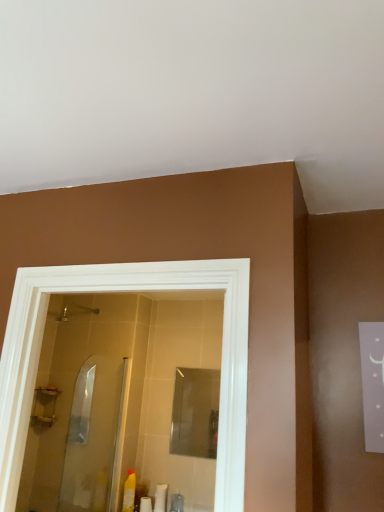
Question: Is white matte tube at lower center, the second toiletry in the right-to-left sequence, oriented towards brushed metal shower at upper left?

Choices:
 (A) no
 (B) yes

Answer: (A)

Question: From a real-world perspective, is white matte tube at lower center, the 2th toiletry positioned from the left, positioned over brushed metal shower at upper left based on gravity?

Choices:
 (A) yes
 (B) no

Answer: (B)

Question: Is white matte tube at lower center, the 2th toiletry positioned from the left, closer to camera compared to brushed metal shower at upper left?

Choices:
 (A) yes
 (B) no

Answer: (A)

Question: Considering the relative sizes of white matte tube at lower center, the second toiletry in the right-to-left sequence, and brushed metal shower at upper left in the image provided, is white matte tube at lower center, the second toiletry in the right-to-left sequence, shorter than brushed metal shower at upper left?

Choices:
 (A) yes
 (B) no

Answer: (B)

Question: Is white matte tube at lower center, the 2th toiletry positioned from the left, outside of brushed metal shower at upper left?

Choices:
 (A) yes
 (B) no

Answer: (A)

Question: From the image's perspective, is white matte tube at lower center, the second toiletry in the right-to-left sequence, located beneath brushed metal shower at upper left?

Choices:
 (A) yes
 (B) no

Answer: (A)

Question: Does brushed metal shower at upper left lie behind clear glass shower door at center?

Choices:
 (A) yes
 (B) no

Answer: (A)

Question: Is brushed metal shower at upper left positioned beyond the bounds of clear glass shower door at center?

Choices:
 (A) yes
 (B) no

Answer: (A)

Question: Does brushed metal shower at upper left have a greater height compared to clear glass shower door at center?

Choices:
 (A) yes
 (B) no

Answer: (B)

Question: Is brushed metal shower at upper left smaller than clear glass shower door at center?

Choices:
 (A) no
 (B) yes

Answer: (B)

Question: Is brushed metal shower at upper left oriented away from clear glass shower door at center?

Choices:
 (A) yes
 (B) no

Answer: (B)

Question: Is brushed metal shower at upper left at the left side of clear glass shower door at center?

Choices:
 (A) yes
 (B) no

Answer: (A)

Question: Can you confirm if translucent plastic bottle at lower center, which is the third toiletry in left-to-right order, is smaller than brushed metal shower at upper left?

Choices:
 (A) no
 (B) yes

Answer: (B)